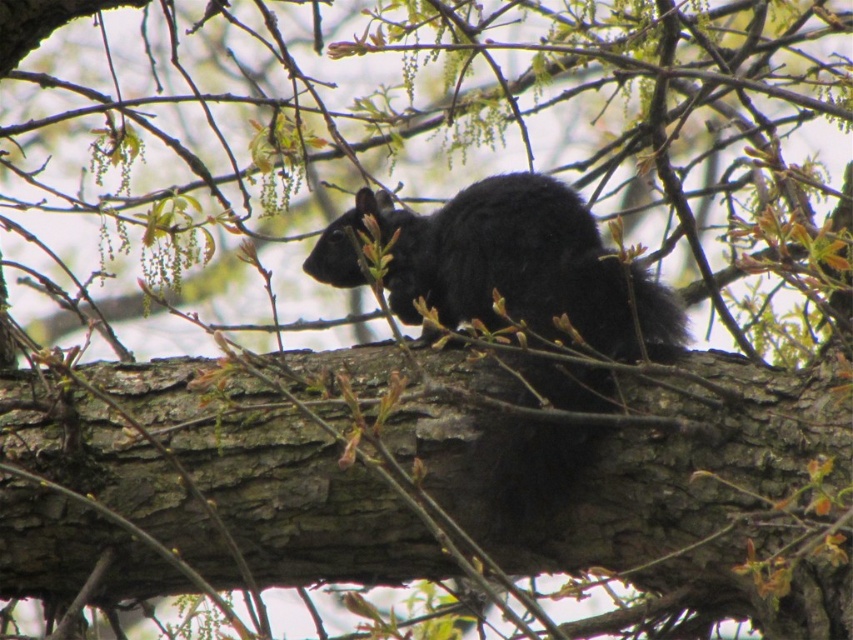
You are a bird flying towards the center of the image and see the brown rough tree trunk at center and the black furry squirrel at center. Which object will you see first as you approach?

The brown rough tree trunk at center is positioned on the left side of black furry squirrel at center, so you will see the black furry squirrel at center first because it is closer to your flight path towards the center.

You are a bird flying over the scene. You want to land on the nearest object to the brown rough tree trunk at center. Which object is closer to it, the black furry squirrel at center or the pale blue sky in the background?

The black furry squirrel at center is closer to the brown rough tree trunk at center than the pale blue sky in the background.